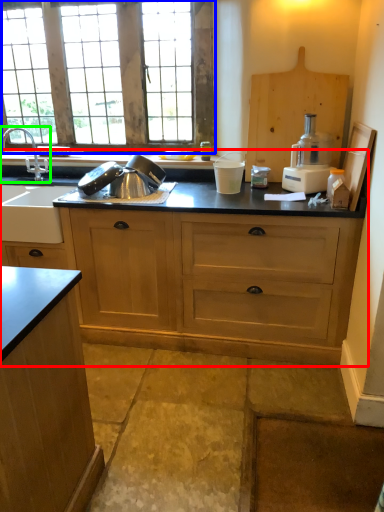
Question: Which is nearer to the countertop (highlighted by a red box)? window (highlighted by a blue box) or tap (highlighted by a green box).

Choices:
 (A) window
 (B) tap

Answer: (A)